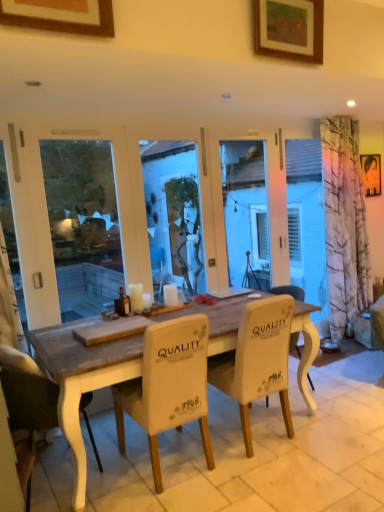
Identify the location of free point above white wood desk at center (from a real-world perspective). The width and height of the screenshot is (384, 512). (241, 456).